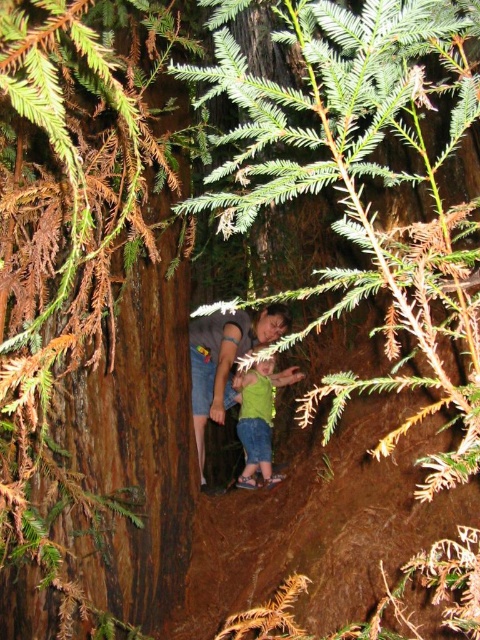
Question: Which object is farther from the camera taking this photo?

Choices:
 (A) green matte shirt at center
 (B) matte gray shirt at center
 (C) brown rough tree trunk at center

Answer: (A)

Question: Considering the relative positions of brown rough tree trunk at center and matte gray shirt at center in the image provided, where is brown rough tree trunk at center located with respect to matte gray shirt at center?

Choices:
 (A) right
 (B) left

Answer: (B)

Question: Is brown rough tree trunk at center positioned at the back of green matte shirt at center?

Choices:
 (A) no
 (B) yes

Answer: (A)

Question: Which of the following is the farthest from the observer?

Choices:
 (A) (205, 332)
 (B) (83, 380)

Answer: (A)

Question: Is brown rough tree trunk at center positioned before matte gray shirt at center?

Choices:
 (A) no
 (B) yes

Answer: (B)

Question: Based on their relative distances, which object is farther from the green matte shirt at center?

Choices:
 (A) matte gray shirt at center
 (B) brown rough tree trunk at center

Answer: (B)